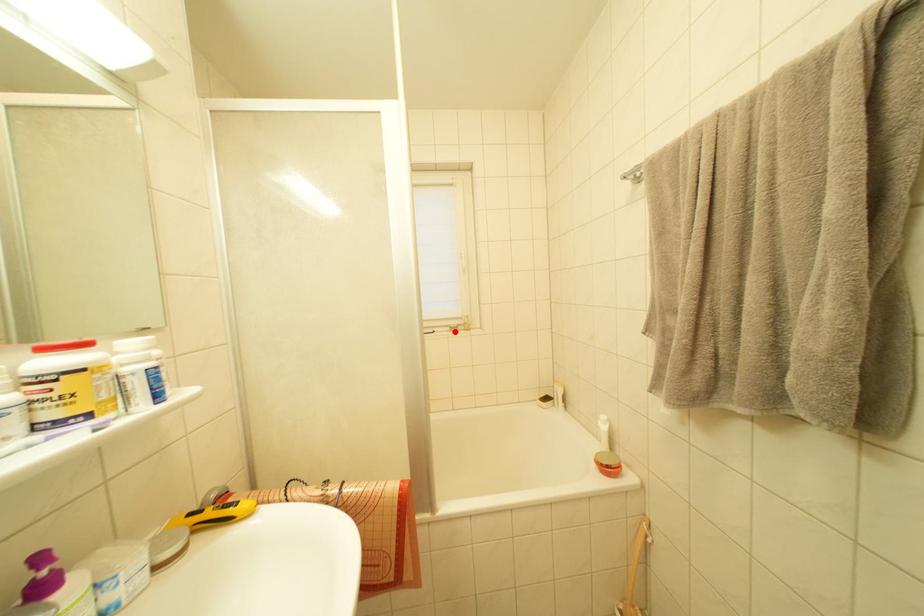
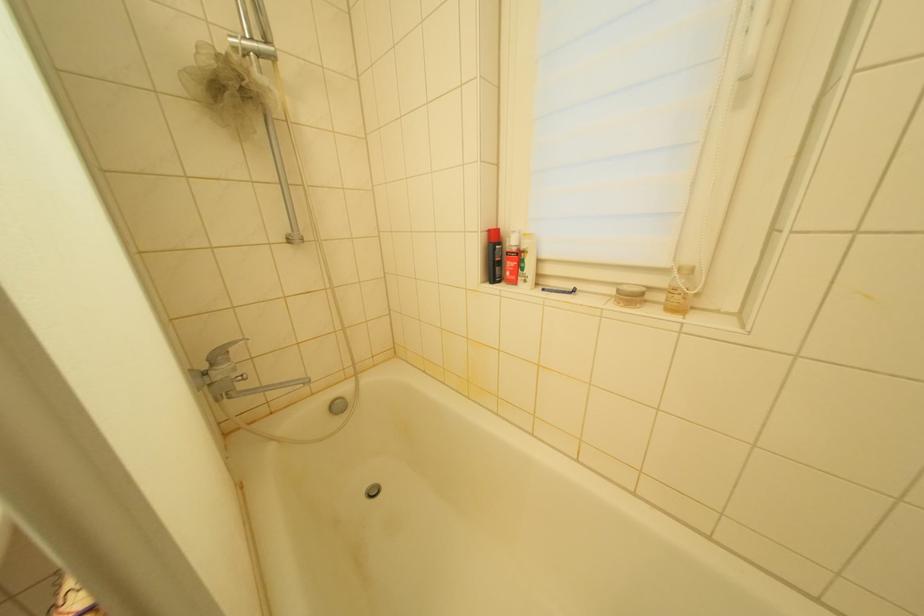
Locate, in the second image, the point that corresponds to the highlighted location in the first image.

(623, 294)